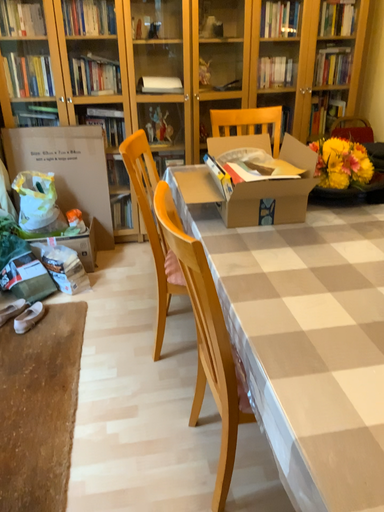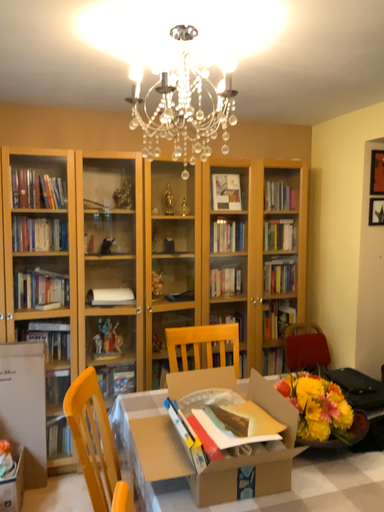
Question: How did the camera likely rotate when shooting the video?

Choices:
 (A) rotated left
 (B) rotated right

Answer: (B)